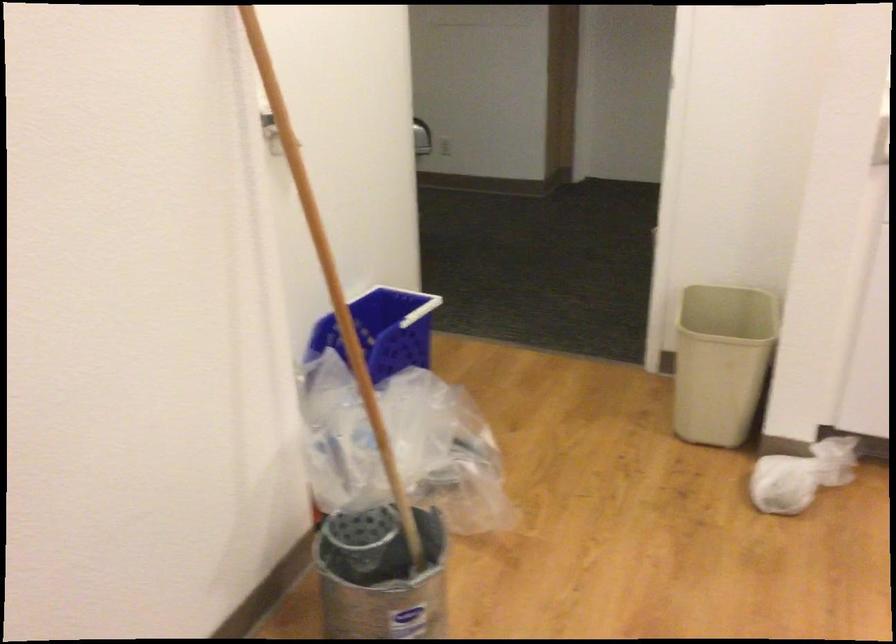
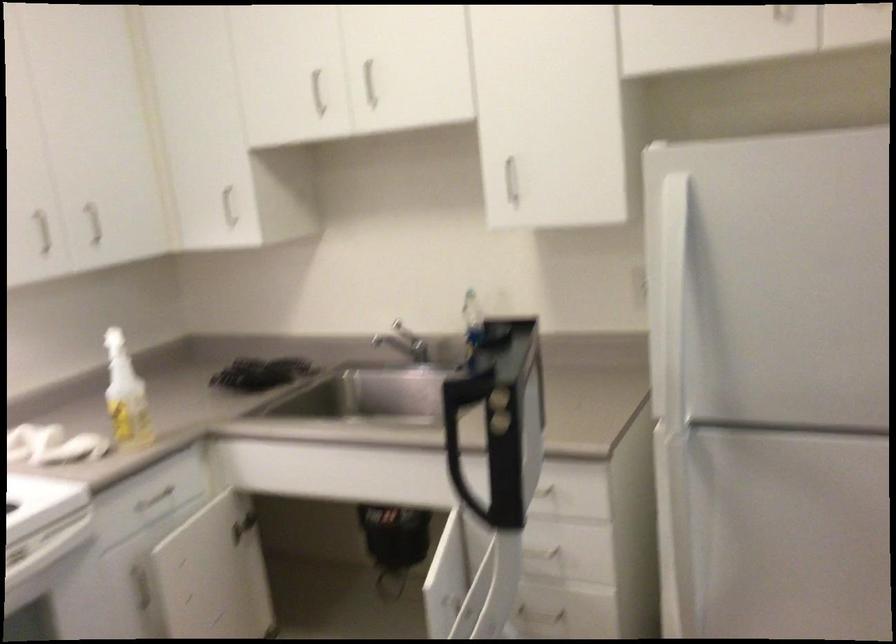
Question: The camera is either moving clockwise (left) or counter-clockwise (right) around the object. The first image is from the beginning of the video and the second image is from the end. Is the camera moving left or right when shooting the video?

Choices:
 (A) Left
 (B) Right

Answer: (A)